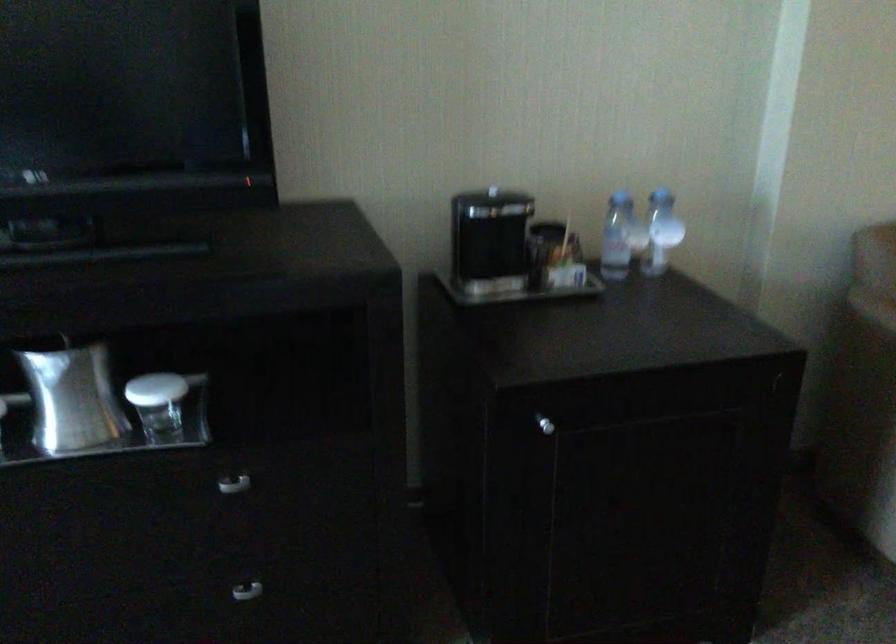
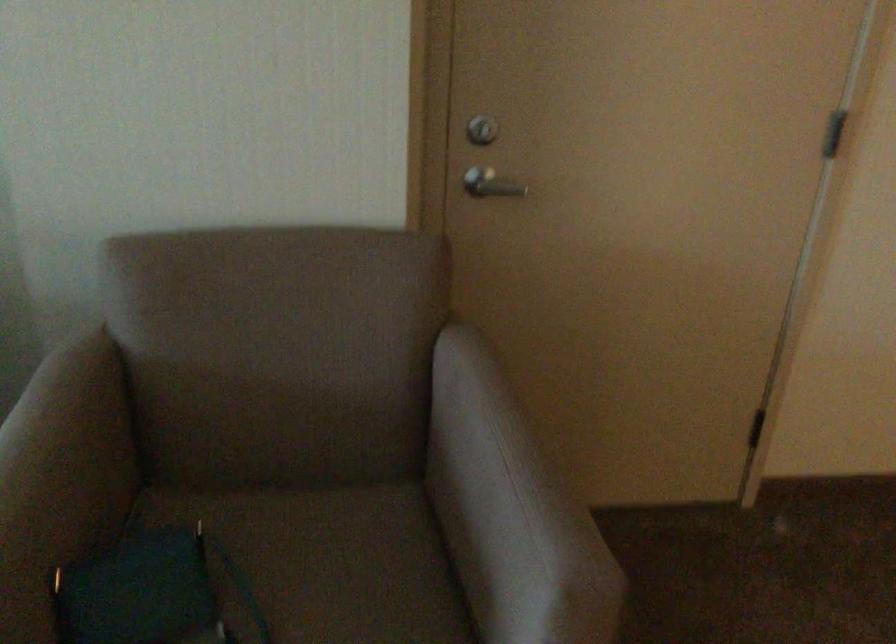
Question: Which direction would the cameraman need to move to produce the second image? Reply with the corresponding letter.

Choices:
 (A) Left
 (B) Right
 (C) Forward
 (D) Backward

Answer: (B)